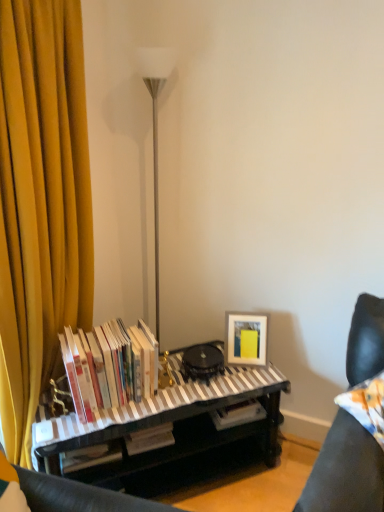
The width and height of the screenshot is (384, 512). In order to click on vacant point above striped fabric piano at center (from a real-world perspective) in this screenshot , I will do `click(178, 387)`.